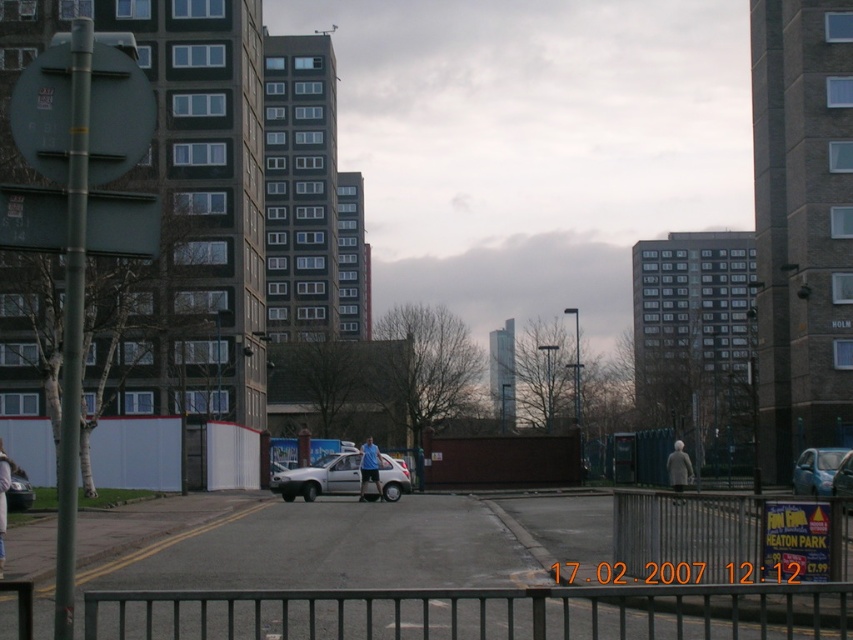
You are standing on the pedestrian walkway and want to know the exact location of the metallic silver fence at lower center. According to the coordinates provided, where is it positioned?

The metallic silver fence at lower center is positioned at point (689, 529).

You are standing at the point with coordinates point (21, 470) and want to walk to the point with coordinates point (633, 618). According to the scene, which direction should you move relative to your current position?

You should move forward because point (633, 618) is in front of point (21, 470).

You are a delivery driver needing to park your vehicle in a compact parking spot that can only accommodate cars up to the size of the blue metallic car at right. You have a silver metallic hatchback at center. Will your car fit in the parking spot?

The silver metallic hatchback at center is bigger than the blue metallic car at right, so it will not fit in the compact parking spot designed for cars the size of the blue metallic car at right.